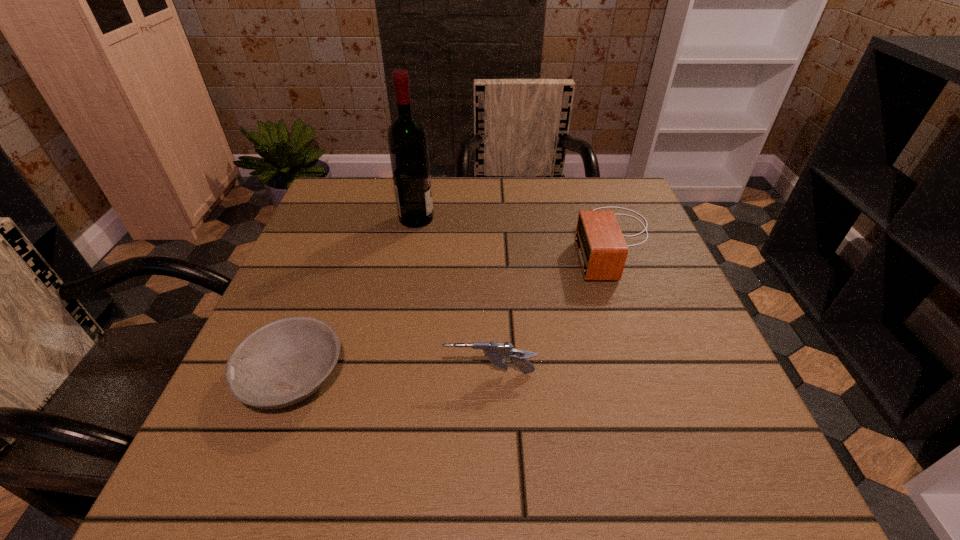
Where is `free spot at the left edge of the desktop`? This screenshot has height=540, width=960. free spot at the left edge of the desktop is located at coordinates (311, 275).

Where is `free space at the right edge`? free space at the right edge is located at coordinates (671, 265).

The height and width of the screenshot is (540, 960). Find the location of `vacant space at the far left corner of the desktop`. vacant space at the far left corner of the desktop is located at coordinates (378, 220).

Where is `free point at the near left corner`? The width and height of the screenshot is (960, 540). free point at the near left corner is located at coordinates (297, 454).

This screenshot has height=540, width=960. Find the location of `vacant space at the far right corner of the desktop`. vacant space at the far right corner of the desktop is located at coordinates (569, 181).

Find the location of a particular element. This screenshot has height=540, width=960. free spot between the radio receiver and the leftmost object is located at coordinates (453, 309).

Where is `empty space between the rightmost object and the gun`? The width and height of the screenshot is (960, 540). empty space between the rightmost object and the gun is located at coordinates (552, 307).

Image resolution: width=960 pixels, height=540 pixels. In order to click on vacant space that's between the alcohol and the gun in this screenshot , I will do `click(453, 296)`.

I want to click on free spot between the shortest object and the rightmost object, so click(x=453, y=309).

Image resolution: width=960 pixels, height=540 pixels. What are the coordinates of `empty space that is in between the leftmost object and the third object from left to right` in the screenshot? It's located at (x=391, y=375).